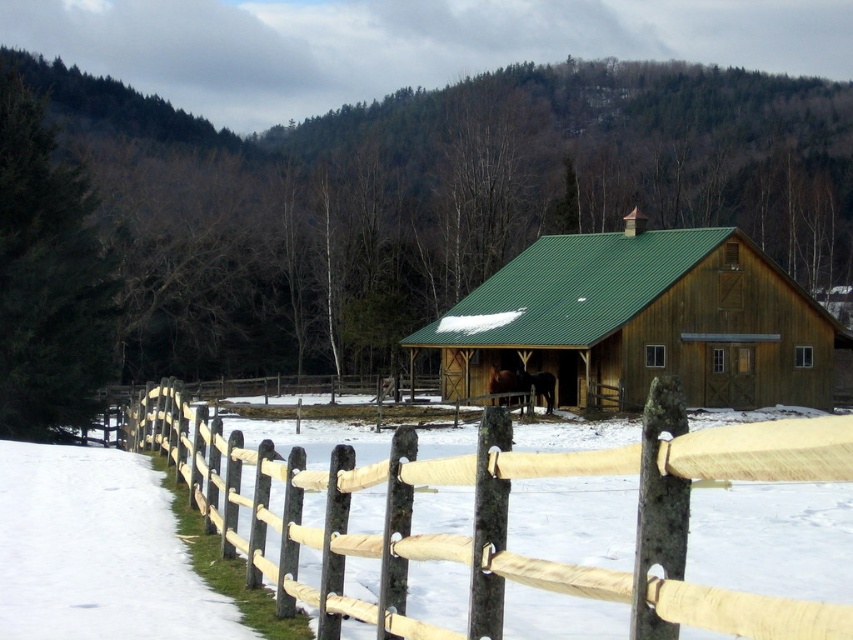
From the picture: You are standing at the origin point in the image and want to walk towards the wooden split rail fence at center. Which direction should you move relative to the fence?

The wooden split rail fence at center is located at point (495, 516), so you should move towards the northeast direction to reach it.

You are standing at the edge of the forest and want to walk towards the wooden split rail fence at center. Will you first step on the white powdery snow at lower left before reaching the fence?

The wooden split rail fence at center is closer to the viewer than white powdery snow at lower left. Therefore, you will reach the wooden split rail fence at center before stepping on the white powdery snow at lower left.